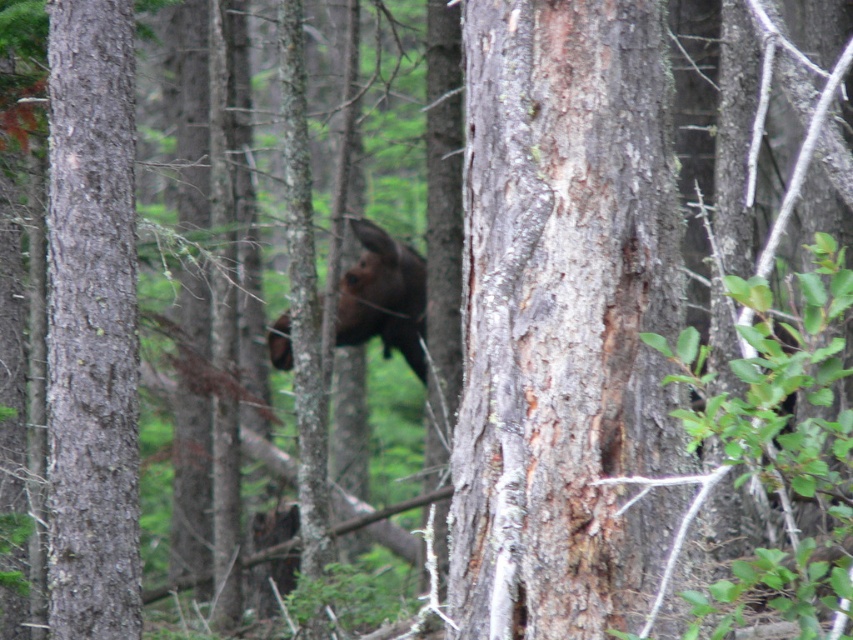
You are a hiker trying to navigate through the forest. You see the gray rough bark tree trunk at center and the smooth brown tree trunk at left. Which tree trunk is closer to you?

The gray rough bark tree trunk at center is closer to you because it is positioned over the smooth brown tree trunk at left, indicating it is in front.

Based on the photo, you are a hiker who wants to take a photo of the brown furry moose at center without getting too close. You have a camera with a zoom lens that can focus up to 20 feet. Is the smooth brown tree trunk at left between you and the moose within the camera range?

The smooth brown tree trunk at left is 21.92 feet from the brown furry moose at center. Since the camera can focus up to 20 feet, the distance is beyond the camera range. Therefore, you cannot take the photo without moving closer.